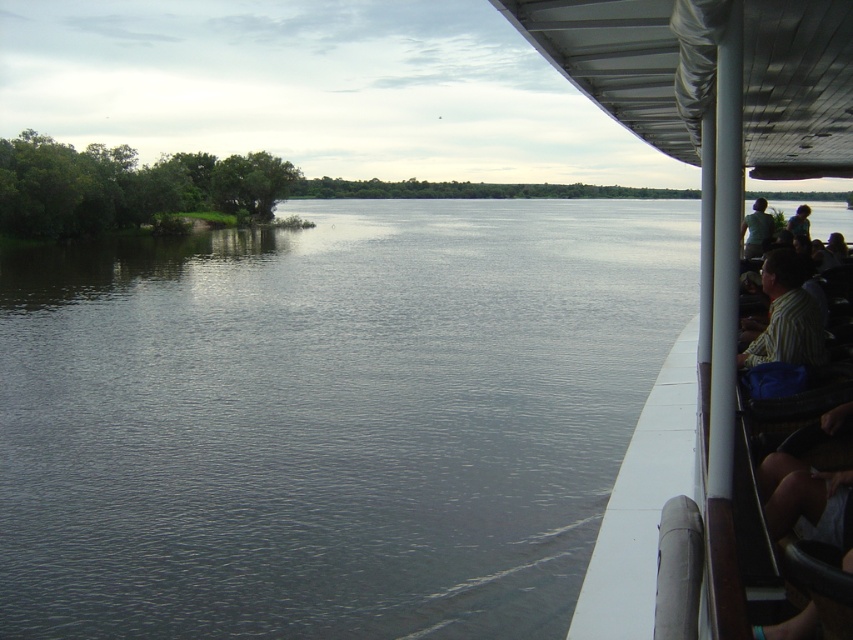
Question: Is the position of striped shirt at right less distant than that of green fabric shirt at upper right?

Choices:
 (A) no
 (B) yes

Answer: (A)

Question: Is white plastic boat at right above striped shirt at right?

Choices:
 (A) yes
 (B) no

Answer: (A)

Question: Is the position of white plastic boat at right less distant than that of green fabric shirt at upper right?

Choices:
 (A) no
 (B) yes

Answer: (B)

Question: Which point appears farthest from the camera in this image?

Choices:
 (A) (730, 97)
 (B) (762, 225)

Answer: (B)

Question: Which of the following is the farthest from the observer?

Choices:
 (A) (782, 289)
 (B) (712, 211)

Answer: (B)

Question: Estimate the real-world distances between objects in this image. Which object is closer to the striped shirt at right?

Choices:
 (A) green fabric shirt at upper right
 (B) white plastic boat at right

Answer: (A)